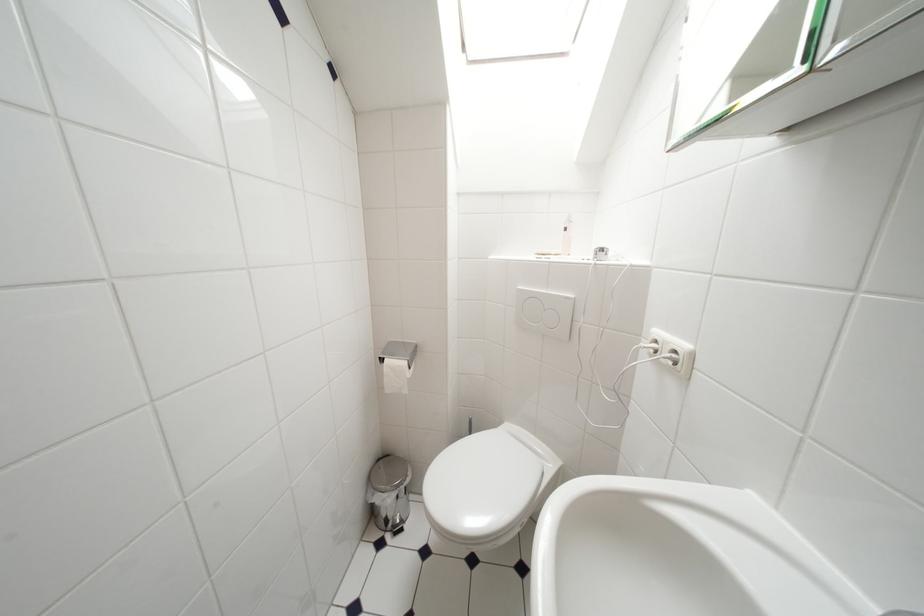
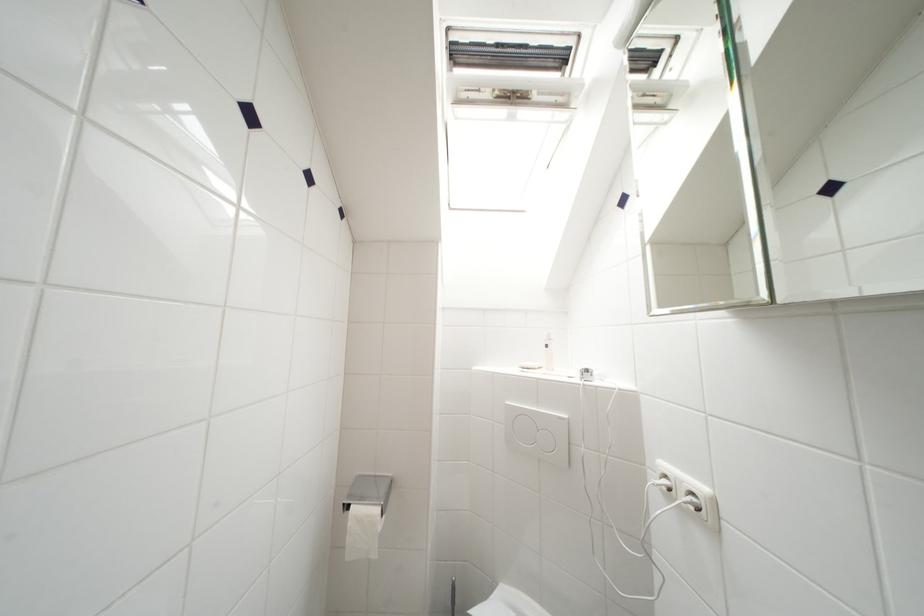
Find the pixel in the second image that matches [663,344] in the first image.

(672, 480)